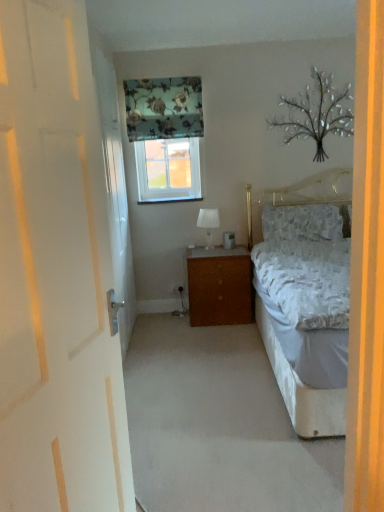
Locate an element on the screen. The height and width of the screenshot is (512, 384). vacant area that is in front of brown wood nightstand at center is located at coordinates (197, 335).